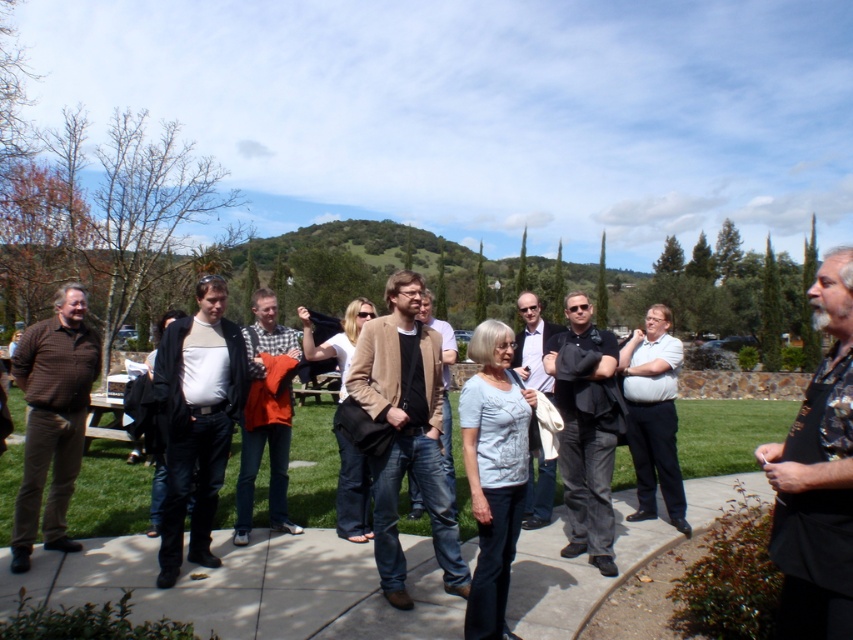
Question: Is gray concrete pavement at center to the left of light brown leather jacket at center from the viewer's perspective?

Choices:
 (A) no
 (B) yes

Answer: (A)

Question: Is floral shirt at right smaller than brown textured shirt at left?

Choices:
 (A) no
 (B) yes

Answer: (B)

Question: Among these points, which one is nearest to the camera?

Choices:
 (A) (76, 301)
 (B) (575, 604)
 (C) (338, 486)

Answer: (B)

Question: Does black leather jacket at center appear on the right side of matte white shirt at center?

Choices:
 (A) no
 (B) yes

Answer: (A)

Question: Among these objects, which one is farthest from the camera?

Choices:
 (A) orange fabric at center
 (B) floral shirt at right
 (C) wooden picnic table at center

Answer: (C)

Question: Which of these objects is positioned closest to the gray concrete pavement at center?

Choices:
 (A) light blue shirt at center
 (B) matte white shirt at center
 (C) wooden picnic table at center

Answer: (A)